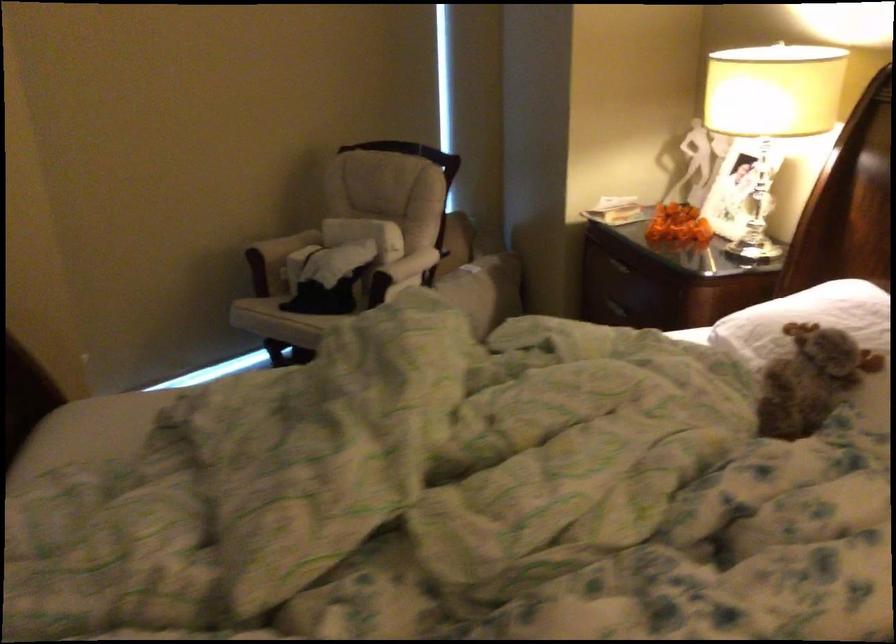
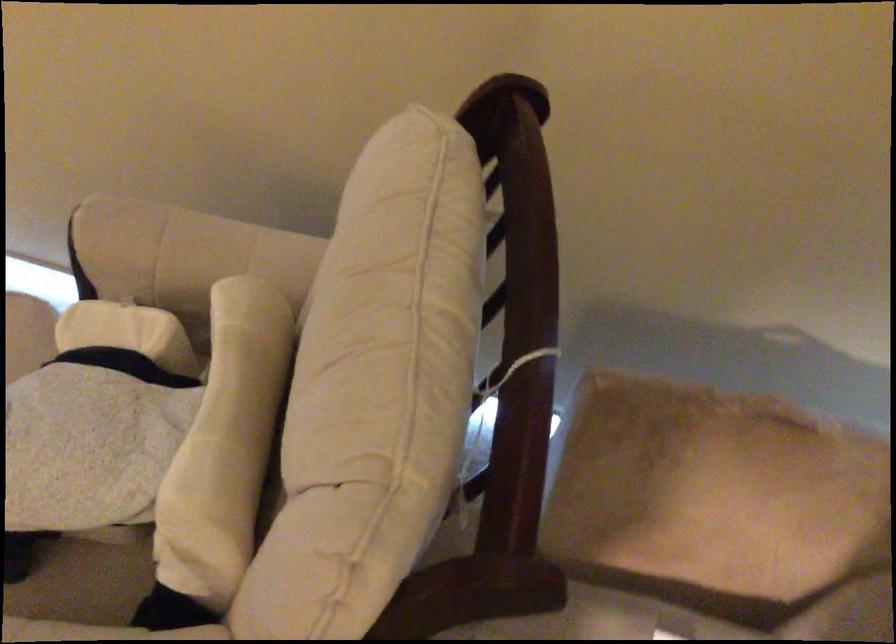
Find the pixel in the second image that matches point 378,216 in the first image.

(225, 444)